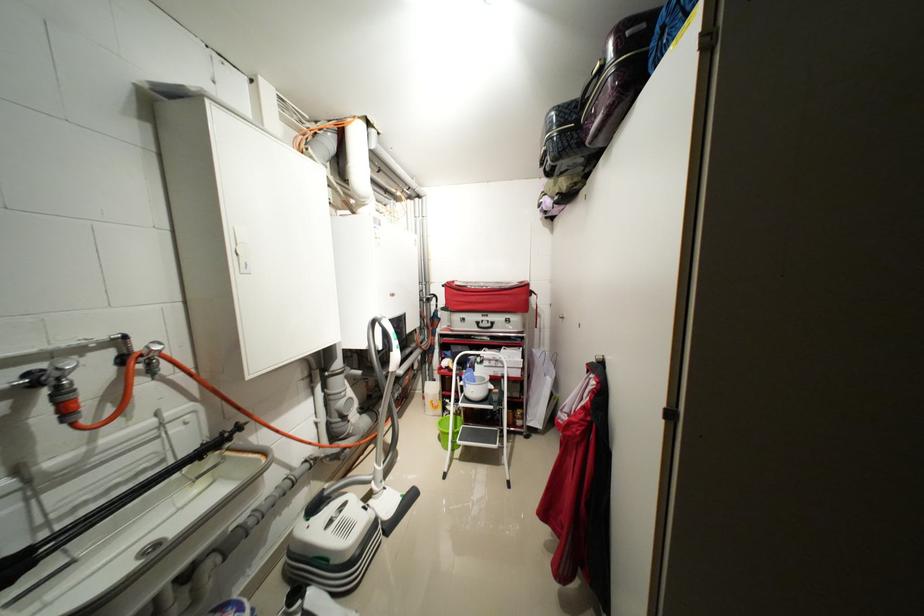
The location [478,408] corresponds to which object?

It corresponds to the white step ladder in the image.